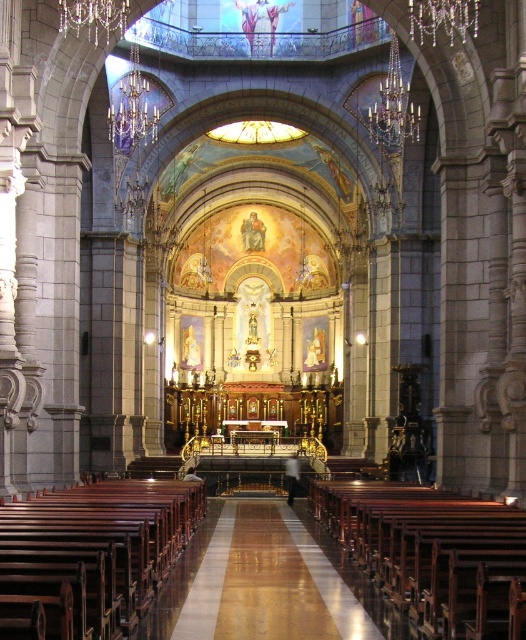
Question: Among these objects, which one is farthest from the camera?

Choices:
 (A) clear crystal chandelier at upper center
 (B) gold metallic chandelier at upper center
 (C) shiny polished wood aisle at center
 (D) wooden polished bench at center

Answer: (B)

Question: Does shiny polished wood aisle at center have a larger size compared to crystal glass chandelier at upper left?

Choices:
 (A) yes
 (B) no

Answer: (A)

Question: Which of the following is the closest to the observer?

Choices:
 (A) (477, 552)
 (B) (104, 580)

Answer: (B)

Question: Which is nearer to the crystal glass chandelier at upper center?

Choices:
 (A) shiny polished wood aisle at center
 (B) polished wood pews at center
 (C) gold metallic chandelier at upper center
 (D) clear crystal chandelier at upper center

Answer: (D)

Question: Is gold metallic chandelier at upper center thinner than clear crystal chandelier at upper center?

Choices:
 (A) yes
 (B) no

Answer: (B)

Question: Can you confirm if gold metallic chandelier at upper center is bigger than clear crystal chandelier at upper center?

Choices:
 (A) yes
 (B) no

Answer: (A)